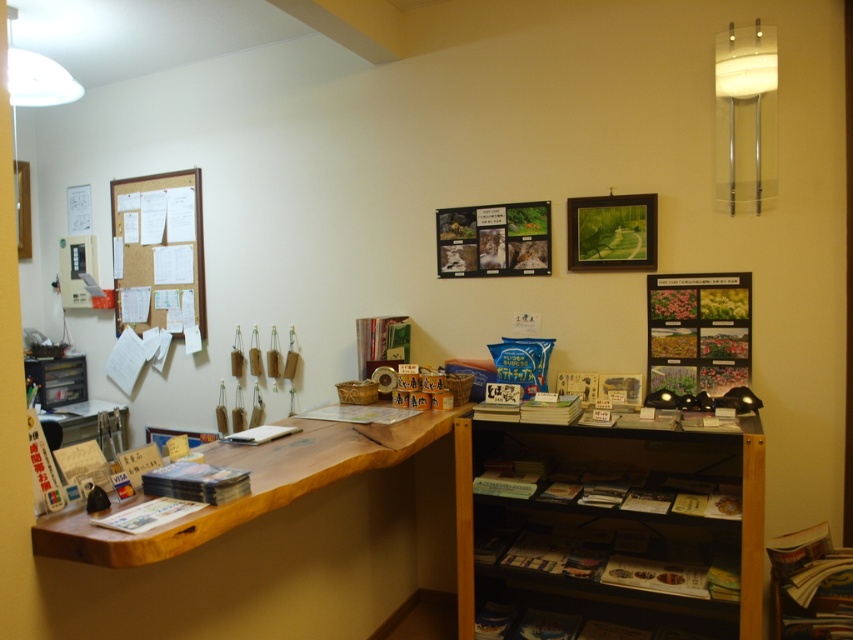
Question: From the image, what is the correct spatial relationship of wooden table at center in relation to white paper book at lower left?

Choices:
 (A) below
 (B) above

Answer: (A)

Question: Estimate the real-world distances between objects in this image. Which object is closer to the wooden desk at lower left?

Choices:
 (A) wooden book at center
 (B) wooden table at center

Answer: (A)

Question: Which of the following is the farthest from the observer?

Choices:
 (A) (279, 490)
 (B) (474, 570)
 (C) (114, 410)
 (D) (281, 429)

Answer: (C)

Question: Which of these objects is positioned farthest from the wooden bookshelf at right?

Choices:
 (A) dark brown paper book at lower center
 (B) wooden table at center

Answer: (B)

Question: Is wooden picture frame at upper center in front of wooden book at center?

Choices:
 (A) yes
 (B) no

Answer: (B)

Question: Can you confirm if wooden picture frame at upper center is wider than wooden book at center?

Choices:
 (A) no
 (B) yes

Answer: (B)